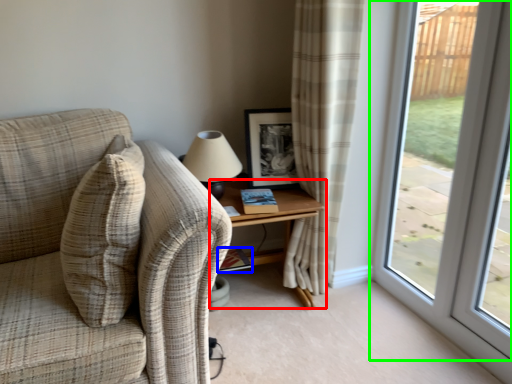
Question: Based on their relative distances, which object is nearer to table (highlighted by a red box)? Choose from book (highlighted by a blue box) and window (highlighted by a green box).

Choices:
 (A) book
 (B) window

Answer: (A)